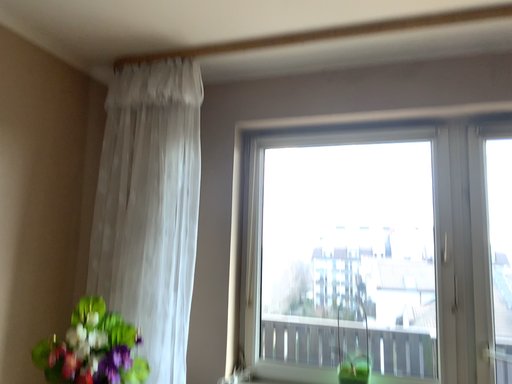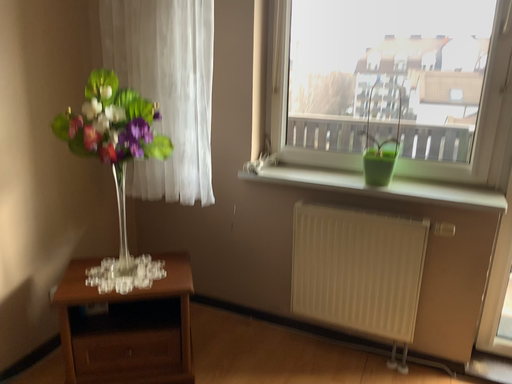
Question: How did the camera likely rotate when shooting the video?

Choices:
 (A) rotated downward
 (B) rotated upward

Answer: (A)